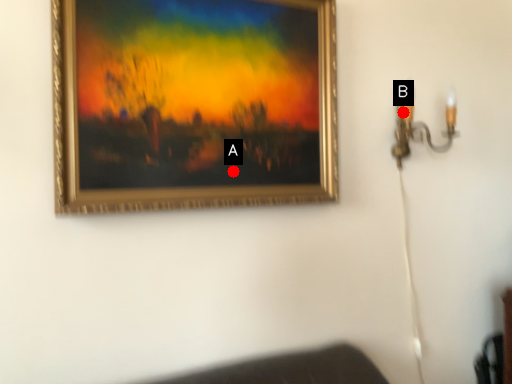
Question: Two points are circled on the image, labeled by A and B beside each circle. Which point is farther from the camera taking this photo?

Choices:
 (A) A is further
 (B) B is further

Answer: (B)